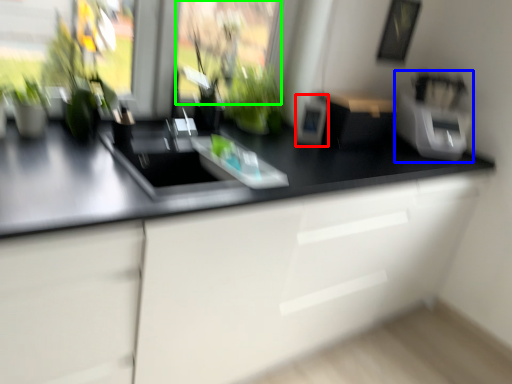
Question: Based on their relative distances, which object is nearer to appliance (highlighted by a red box)? Choose from appliance (highlighted by a blue box) and window screen (highlighted by a green box).

Choices:
 (A) appliance
 (B) window screen

Answer: (B)